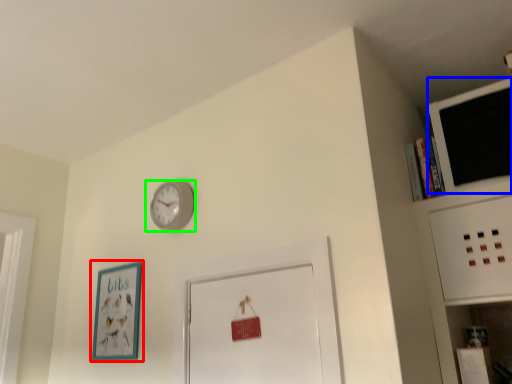
Question: Based on their relative distances, which object is farther from picture frame (highlighted by a red box)? Choose from computer monitor (highlighted by a blue box) and wall clock (highlighted by a green box).

Choices:
 (A) computer monitor
 (B) wall clock

Answer: (A)